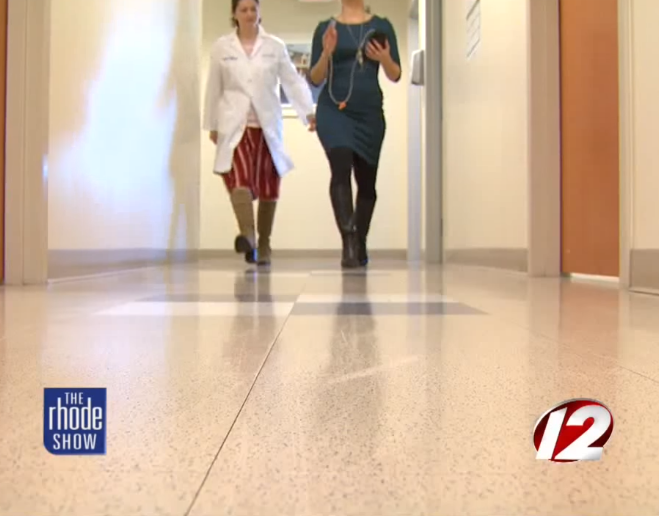
The width and height of the screenshot is (659, 516). Find the location of `gap under door`. gap under door is located at coordinates click(x=588, y=276).